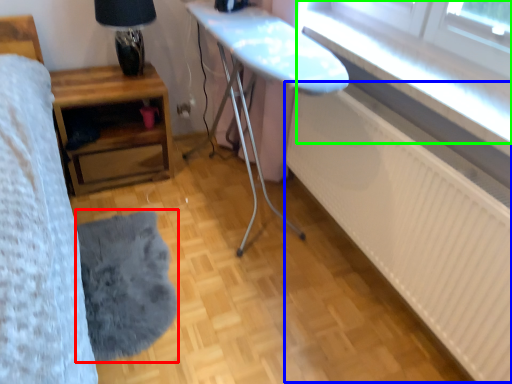
Question: Considering the real-world distances, which object is farthest from mat (highlighted by a red box)? radiator (highlighted by a blue box) or window (highlighted by a green box)?

Choices:
 (A) radiator
 (B) window

Answer: (B)